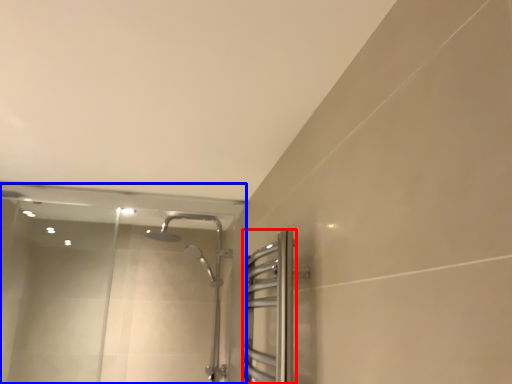
Question: Which of the following is the closest to the observer, screen door (highlighted by a red box) or glass door (highlighted by a blue box)?

Choices:
 (A) screen door
 (B) glass door

Answer: (A)